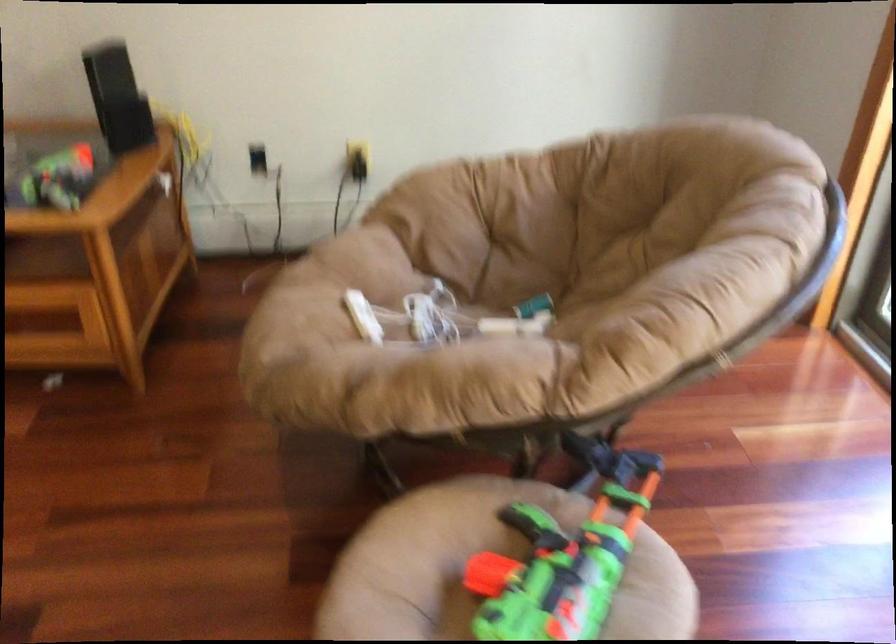
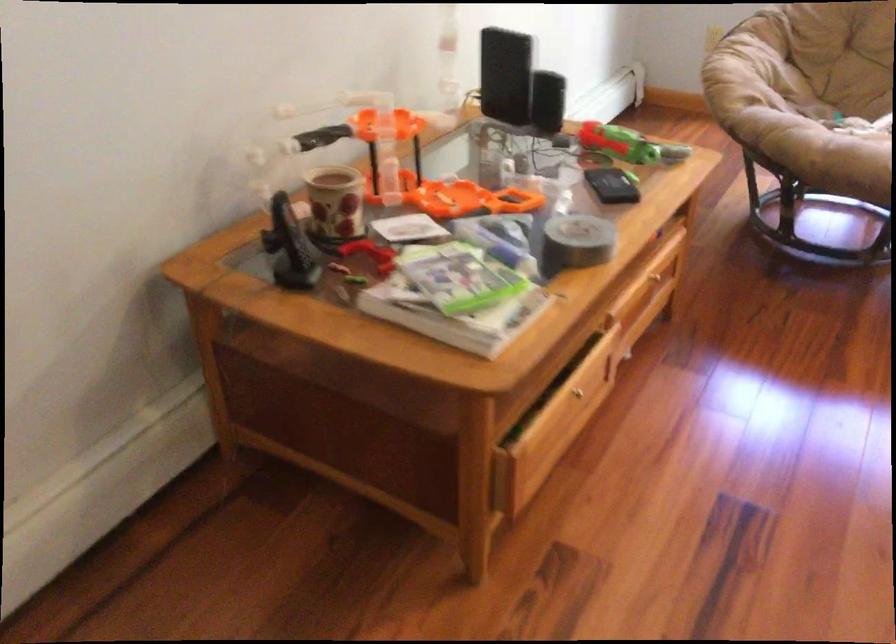
Locate, in the second image, the point that corresponds to the point at 556,319 in the first image.

(842, 118)